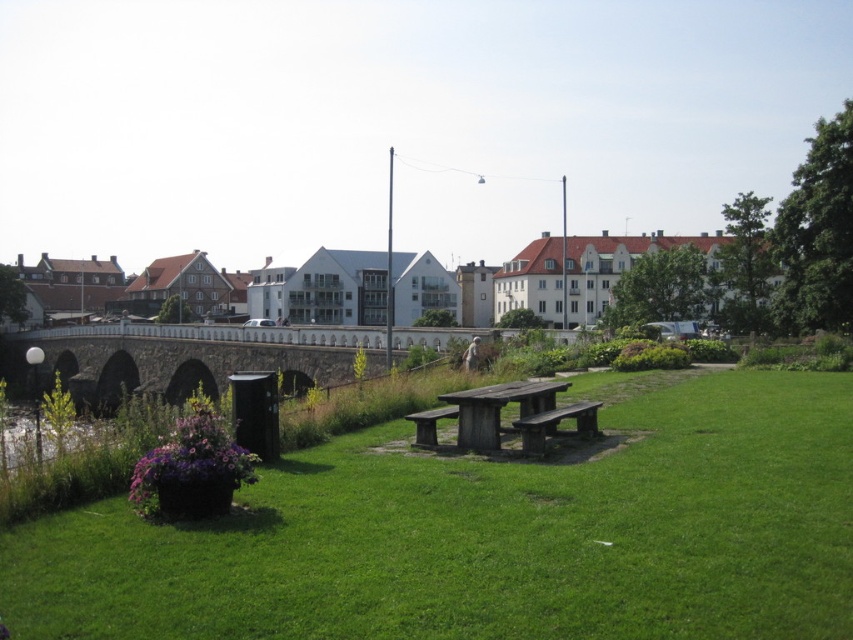
Question: Can you confirm if wooden picnic table at center is positioned to the right of wooden park bench at center?

Choices:
 (A) no
 (B) yes

Answer: (B)

Question: Which object is the farthest from the stone arch bridge at center?

Choices:
 (A) wooden park bench at center
 (B) wooden picnic table at center
 (C) green grassy park at center

Answer: (A)

Question: Which of the following is the closest to the observer?

Choices:
 (A) (492, 396)
 (B) (77, 568)
 (C) (442, 410)
 (D) (339, 356)

Answer: (B)

Question: Which is farther from the stone arch bridge at center?

Choices:
 (A) green grassy park at center
 (B) wooden bench at center
 (C) wooden picnic table at center

Answer: (B)

Question: Does wooden park bench at center appear over wooden bench at center?

Choices:
 (A) no
 (B) yes

Answer: (A)

Question: Is stone arch bridge at center positioned before wooden picnic table at center?

Choices:
 (A) no
 (B) yes

Answer: (A)